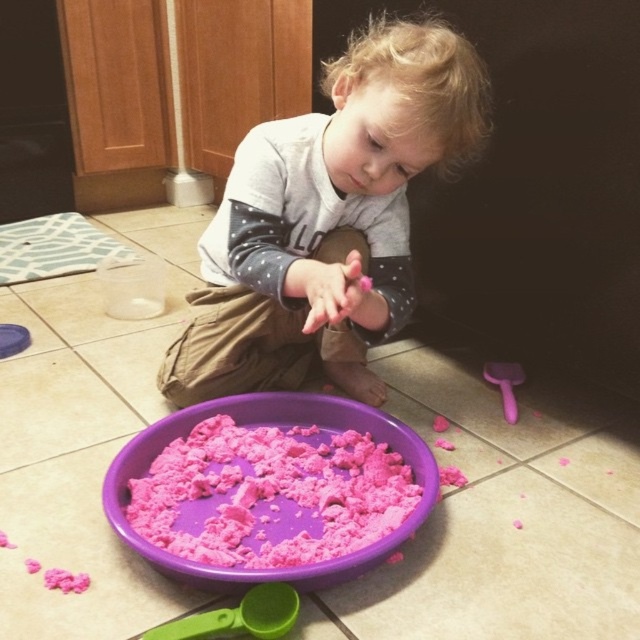
Question: Is matte gray shirt at center further to camera compared to pink plastic scoop at lower right?

Choices:
 (A) no
 (B) yes

Answer: (A)

Question: Among these objects, which one is nearest to the camera?

Choices:
 (A) purple plastic bowl at lower center
 (B) matte gray shirt at center

Answer: (A)

Question: Which object appears closest to the camera in this image?

Choices:
 (A) pink plastic scoop at lower right
 (B) green plastic spoon at lower left
 (C) purple plastic bowl at lower center
 (D) matte gray shirt at center

Answer: (B)

Question: Where is green plastic spoon at lower left located in relation to pink plastic scoop at lower right in the image?

Choices:
 (A) below
 (B) above

Answer: (A)

Question: Which point is closer to the camera?

Choices:
 (A) (502, 381)
 (B) (404, 106)
 (C) (314, 576)
 (D) (262, 592)

Answer: (C)

Question: Is green plastic spoon at lower left in front of pink plastic scoop at lower right?

Choices:
 (A) no
 (B) yes

Answer: (B)